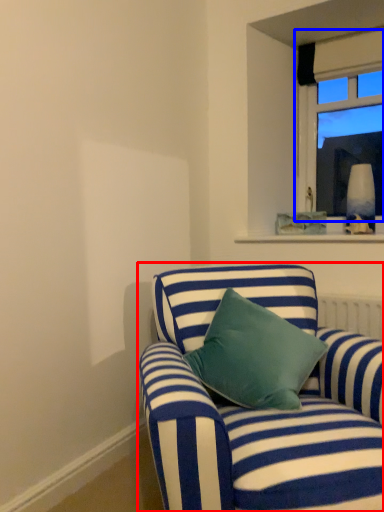
Question: Which object appears closest to the camera in this image, studio couch (highlighted by a red box) or window (highlighted by a blue box)?

Choices:
 (A) studio couch
 (B) window

Answer: (A)